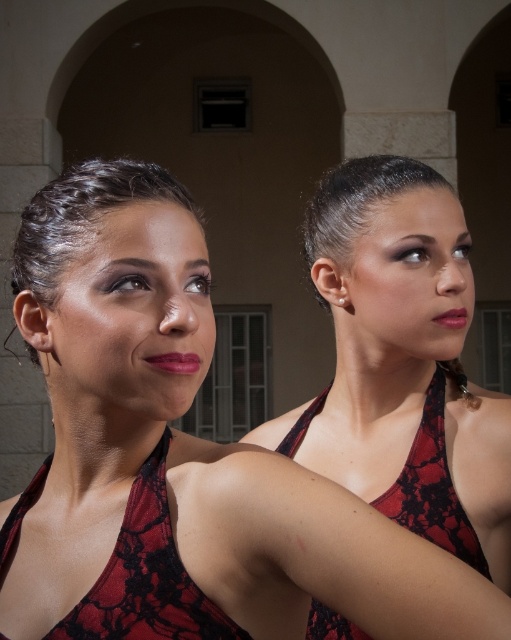
Is lace fabric dress at center above matte red lipstick at right?

No, lace fabric dress at center is not above matte red lipstick at right.

Can you confirm if lace fabric dress at center is positioned to the right of matte red lipstick at right?

In fact, lace fabric dress at center is to the left of matte red lipstick at right.

Image resolution: width=511 pixels, height=640 pixels. Describe the element at coordinates (147, 577) in the screenshot. I see `lace fabric dress at center` at that location.

Locate an element on the screen. This screenshot has height=640, width=511. lace fabric dress at center is located at coordinates (147, 577).

Is red lace dress at center above matte pink lipstick at center?

Incorrect, red lace dress at center is not positioned above matte pink lipstick at center.

Does point (394, 492) come behind point (166, 356)?

Yes, it is.

Identify the location of red lace dress at center. (431, 486).

Is point (146, 470) positioned after point (179, 358)?

Yes, point (146, 470) is behind point (179, 358).

Between lace fabric dress at center and matte pink lipstick at center, which one appears on the right side from the viewer's perspective?

matte pink lipstick at center

Does point (143, 593) come closer to viewer compared to point (152, 355)?

Yes.

The height and width of the screenshot is (640, 511). Identify the location of lace fabric dress at center. (147, 577).